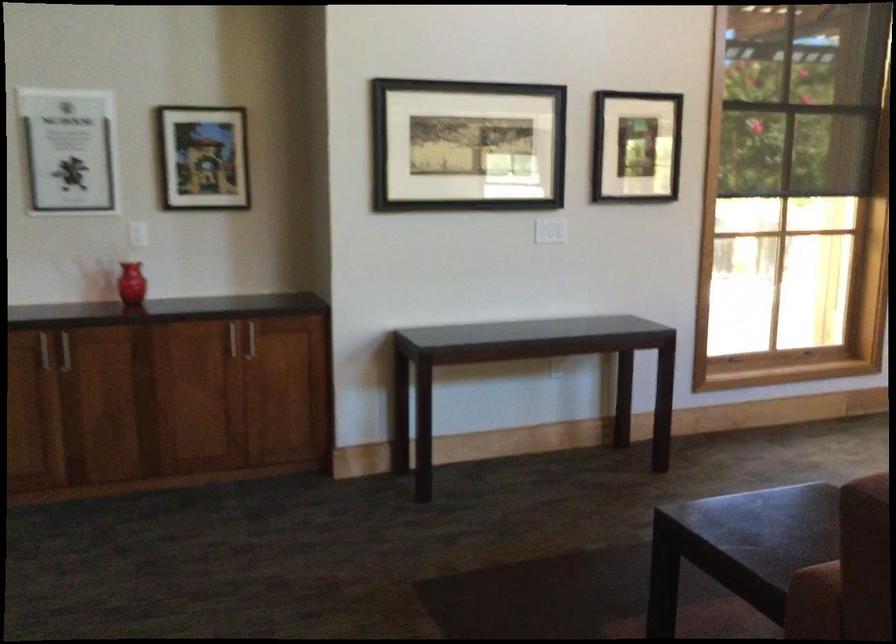
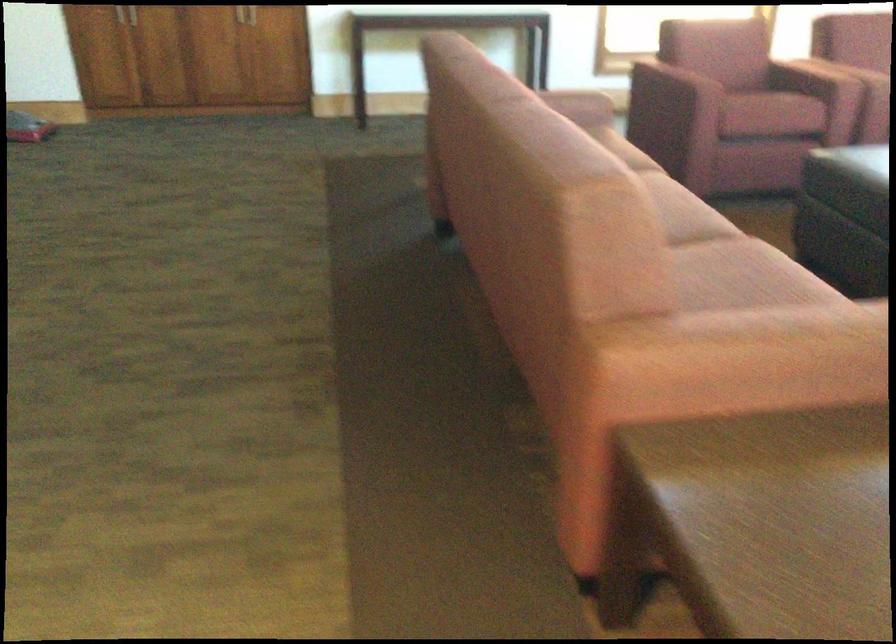
What movement of the cameraman would produce the second image?

A: The cameraman walked toward right, backward.